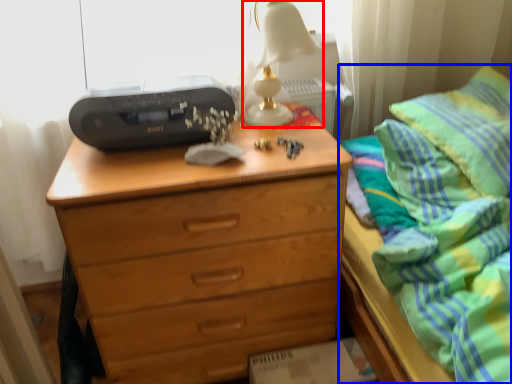
Question: Which point is further to the camera, table lamp (highlighted by a red box) or bed (highlighted by a blue box)?

Choices:
 (A) table lamp
 (B) bed

Answer: (A)